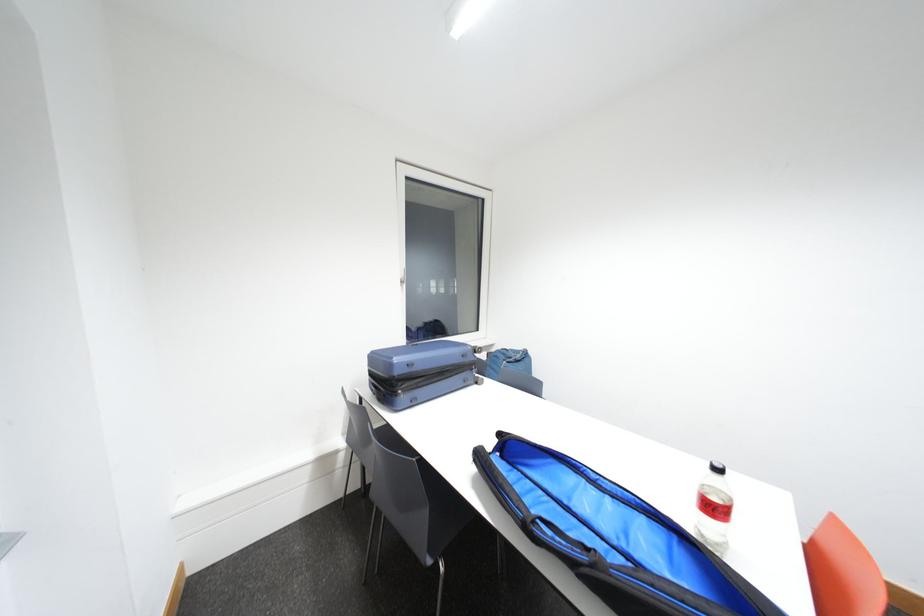
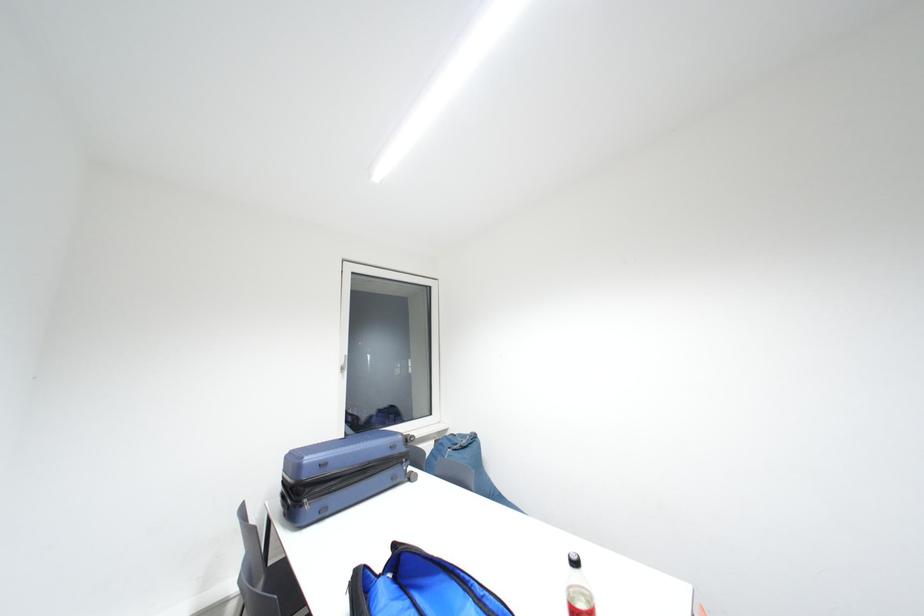
Question: The images are taken continuously from a first-person perspective. In which direction is your viewpoint rotating?

Choices:
 (A) Left
 (B) Right
 (C) Up
 (D) Down

Answer: (C)